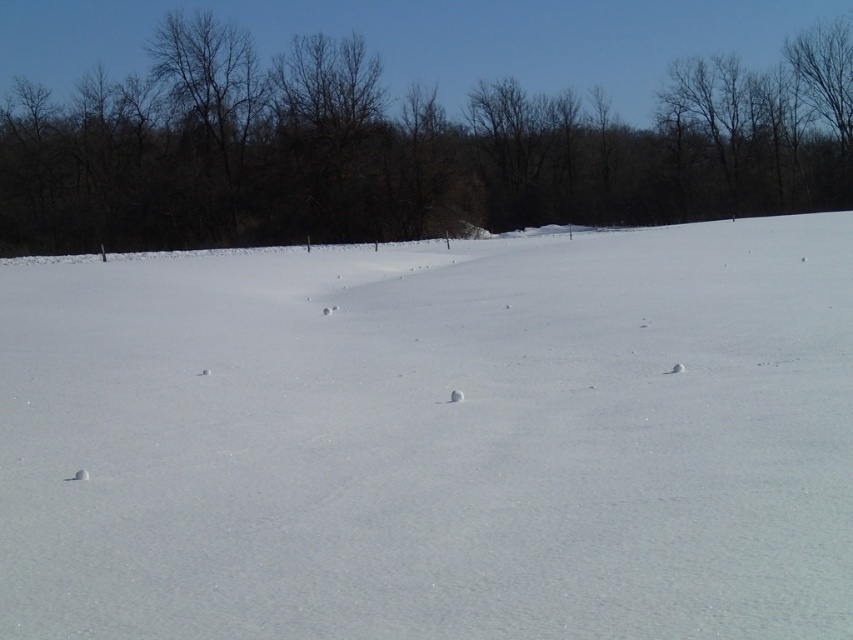
Who is more distant from viewer, (285,611) or (532,141)?

The point (532,141) is behind.

Who is more forward, (648, 560) or (419, 168)?

Point (648, 560) is more forward.

Where is `white snow at center`? Image resolution: width=853 pixels, height=640 pixels. white snow at center is located at coordinates (434, 438).